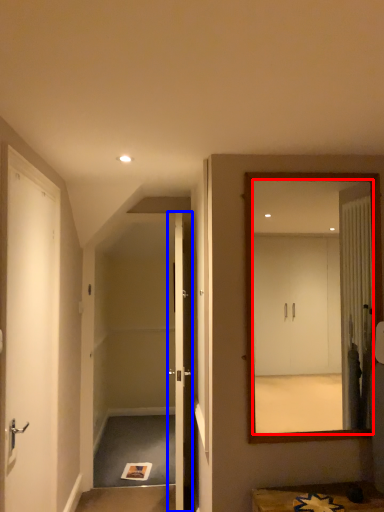
Question: Among these objects, which one is farthest to the camera, mirror (highlighted by a red box) or door (highlighted by a blue box)?

Choices:
 (A) mirror
 (B) door

Answer: (B)